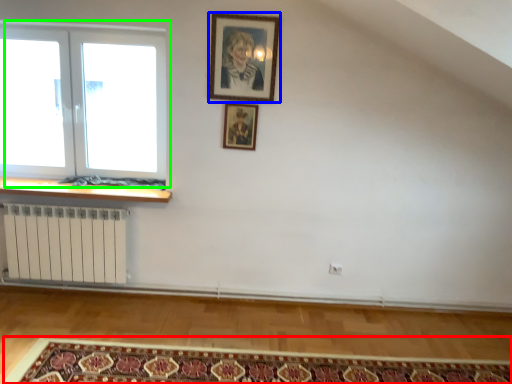
Question: Considering the real-world distances, which object is farthest from mat (highlighted by a red box)? picture frame (highlighted by a blue box) or window (highlighted by a green box)?

Choices:
 (A) picture frame
 (B) window

Answer: (A)